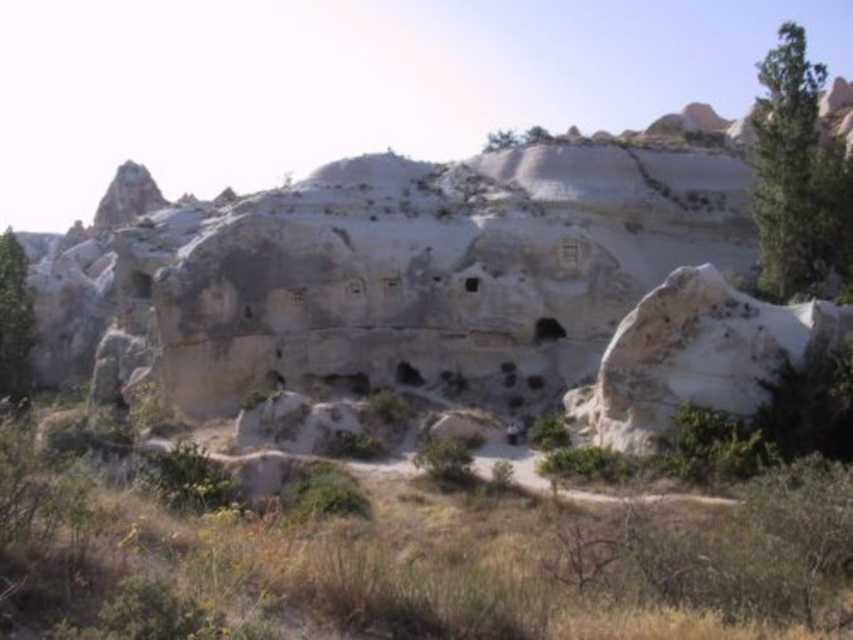
You are standing in the middle of the rugged landscape and see the green leafy tree at upper right and the green leafy tree at left. Which tree is closer to you?

The green leafy tree at upper right is closer to you because it is in front of the green leafy tree at left.

You are planning to set up a temporary campsite in this area. You need to choose between the white rock formation at center and the green leafy tree at upper right as a shelter. Based on their sizes, which would provide more coverage?

The white rock formation at center has a larger width than the green leafy tree at upper right, so it would provide more coverage for the campsite.